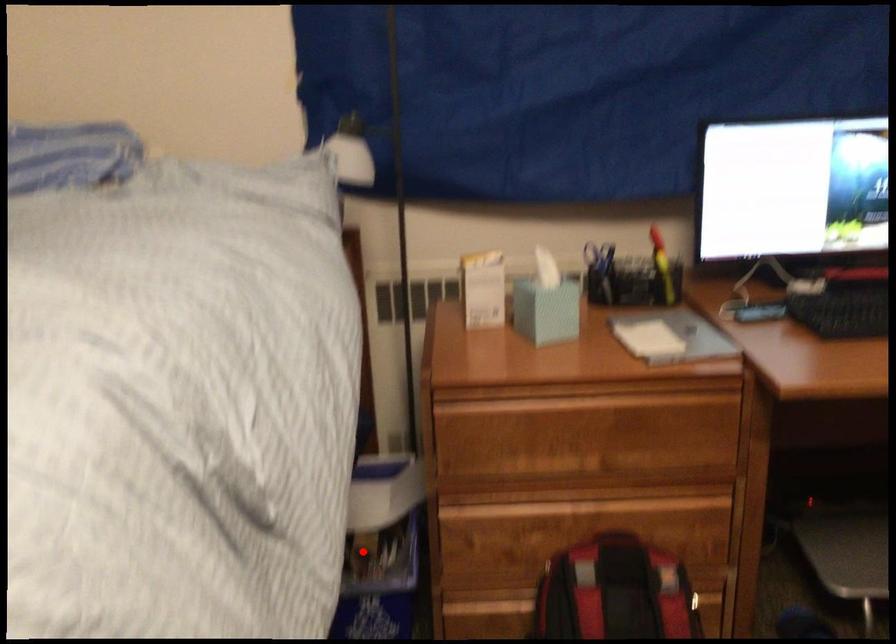
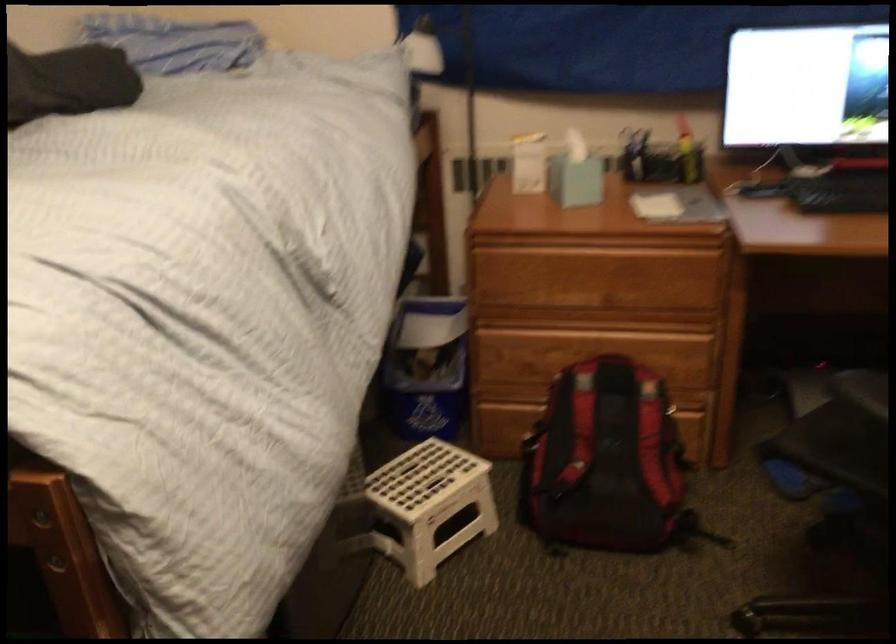
Question: I am providing you with two images of the same scene from different viewpoints. Image1 has a red point marked. In image2, the corresponding 3D location appears at what relative position? Reply with the corresponding letter.

Choices:
 (A) Closer
 (B) Farther

Answer: (B)